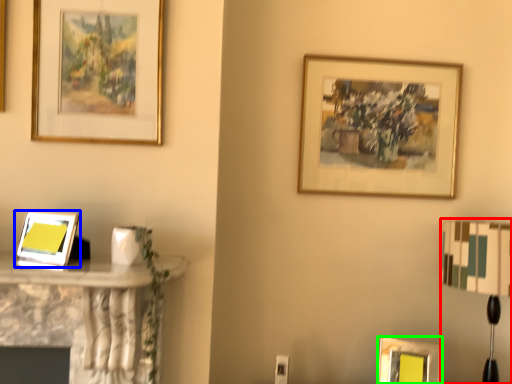
Question: Which object is the farthest from table lamp (highlighted by a red box)? Choose among these: picture frame (highlighted by a blue box) or picture frame (highlighted by a green box).

Choices:
 (A) picture frame
 (B) picture frame

Answer: (A)